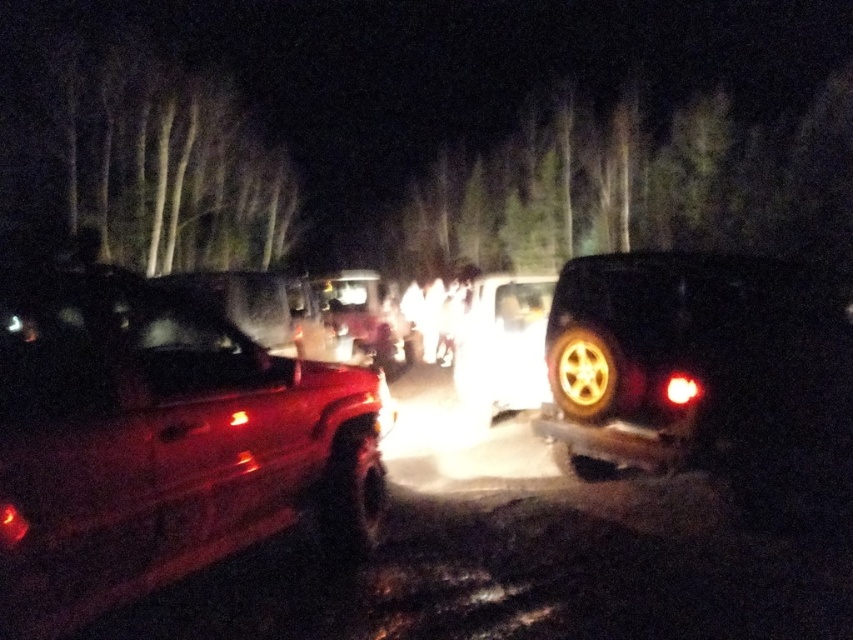
You are a GUI agent. You are given a task and a screenshot of the screen. Output one action in this format:
    pyautogui.click(x=<x>, y=<y>)
    Task: Click on the matte red truck at left
    The height and width of the screenshot is (640, 853).
    Given the screenshot: What is the action you would take?
    pyautogui.click(x=161, y=444)

Does matte red truck at left appear on the right side of rubber/textured tire at center?

In fact, matte red truck at left is to the left of rubber/textured tire at center.

Does point (363, 540) come farther from viewer compared to point (341, 500)?

Yes.

What are the coordinates of `matte red truck at left` in the screenshot? It's located at tap(161, 444).

How distant is matte black suv at right from shiny metallic tire at right?

matte black suv at right and shiny metallic tire at right are 6.48 inches apart from each other.

The height and width of the screenshot is (640, 853). Describe the element at coordinates (694, 362) in the screenshot. I see `matte black suv at right` at that location.

At what (x,y) coordinates should I click in order to perform the action: click on matte black suv at right. Please return your answer as a coordinate pair (x, y). Looking at the image, I should click on (694, 362).

Is matte red truck at left to the right of shiny metallic tire at right from the viewer's perspective?

Incorrect, matte red truck at left is not on the right side of shiny metallic tire at right.

Between point (30, 282) and point (569, 348), which one is positioned behind?

The point (569, 348) is behind.

This screenshot has width=853, height=640. What do you see at coordinates (161, 444) in the screenshot?
I see `matte red truck at left` at bounding box center [161, 444].

Where is `matte red truck at left`? This screenshot has width=853, height=640. matte red truck at left is located at coordinates (161, 444).